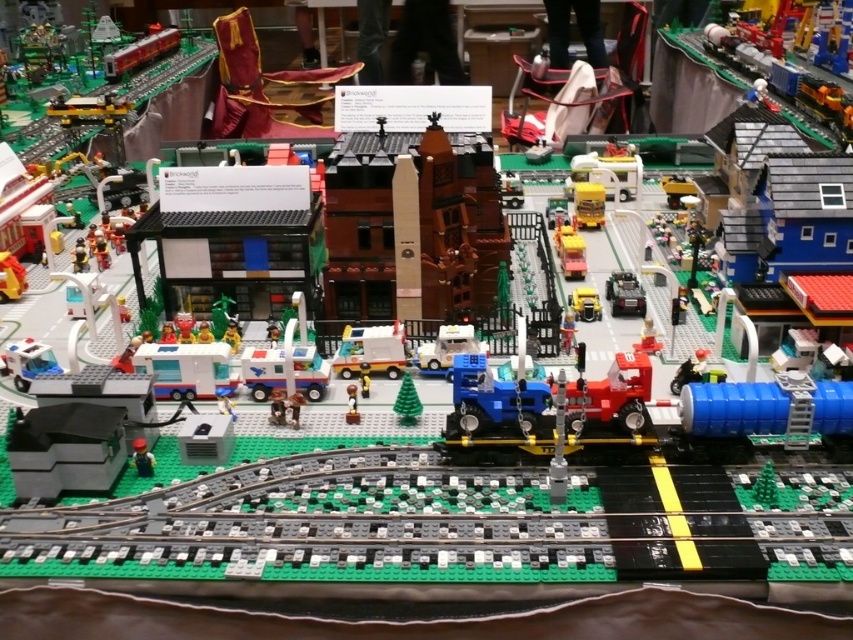
From the picture: Is white plastic ambulance at center behind green matte figure at lower left?

Yes, white plastic ambulance at center is further from the viewer.

Does white plastic ambulance at center appear over green matte figure at lower left?

Yes.

Is point (387, 355) in front of point (136, 460)?

No, (387, 355) is behind (136, 460).

I want to click on white plastic ambulance at center, so click(370, 349).

Is white plastic ambulance at center shorter than yellow matte truck at center?

Correct, white plastic ambulance at center is not as tall as yellow matte truck at center.

Between white plastic ambulance at center and yellow matte truck at center, which one appears on the right side from the viewer's perspective?

Positioned to the right is yellow matte truck at center.

Between point (343, 372) and point (555, 232), which one is positioned in front?

Point (343, 372) is in front.

The width and height of the screenshot is (853, 640). Identify the location of white plastic ambulance at center. (370, 349).

Which of these two, metallic red train at upper left or yellow plastic truck at center-right, stands shorter?

yellow plastic truck at center-right

Who is taller, metallic red train at upper left or yellow plastic truck at center-right?

With more height is metallic red train at upper left.

Does point (161, 32) come closer to viewer compared to point (602, 198)?

No, (161, 32) is behind (602, 198).

You are a GUI agent. You are given a task and a screenshot of the screen. Output one action in this format:
    pyautogui.click(x=<x>, y=<y>)
    Task: Click on the metallic red train at upper left
    This screenshot has width=853, height=640.
    Given the screenshot: What is the action you would take?
    pyautogui.click(x=140, y=52)